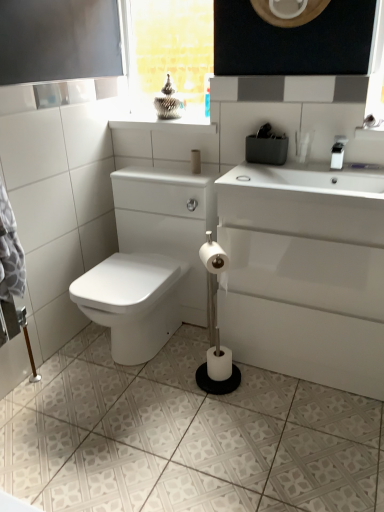
I want to click on vacant space to the left of matte beige toilet paper at center, acting as the 3th toilet paper starting from the front, so click(160, 173).